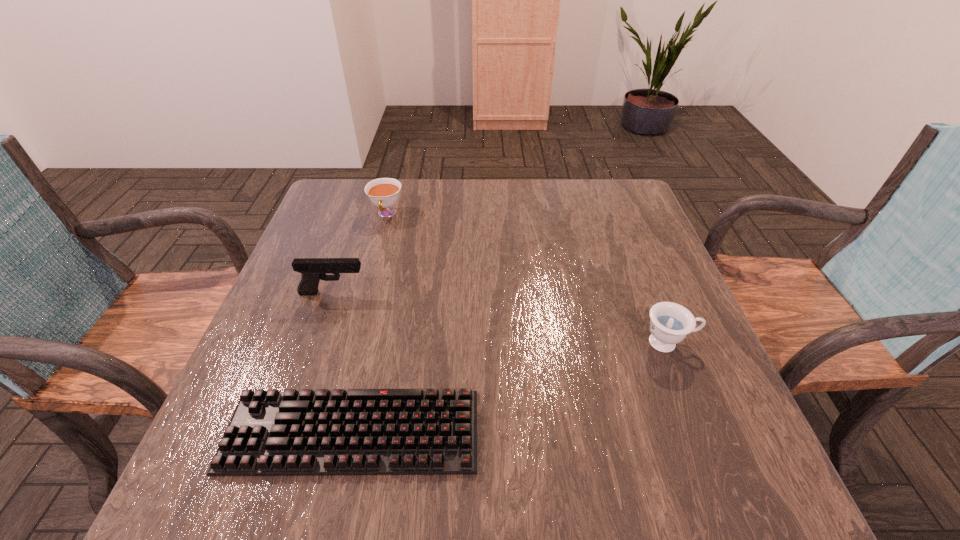
Locate an element on the screen. Image resolution: width=960 pixels, height=540 pixels. the tallest object is located at coordinates (312, 270).

Image resolution: width=960 pixels, height=540 pixels. In order to click on pistol in this screenshot , I will do `click(312, 270)`.

Find the location of a particular element. This screenshot has height=540, width=960. the left teacup is located at coordinates (383, 192).

Identify the location of the farther teacup. This screenshot has height=540, width=960. (383, 192).

At what (x,y) coordinates should I click in order to perform the action: click on the right teacup. Please return your answer as a coordinate pair (x, y). The width and height of the screenshot is (960, 540). Looking at the image, I should click on (670, 323).

Locate an element on the screen. the third farthest object is located at coordinates (670, 323).

Image resolution: width=960 pixels, height=540 pixels. Find the location of `the shortest object`. the shortest object is located at coordinates (360, 431).

Find the location of a particular element. The image size is (960, 540). the nearest object is located at coordinates (360, 431).

This screenshot has width=960, height=540. In order to click on vacant space situated 0.300m on the front-facing side of the tallest object in this screenshot , I will do `click(499, 293)`.

The height and width of the screenshot is (540, 960). I want to click on vacant space situated on the side of the farther teacup with the handle, so click(x=372, y=273).